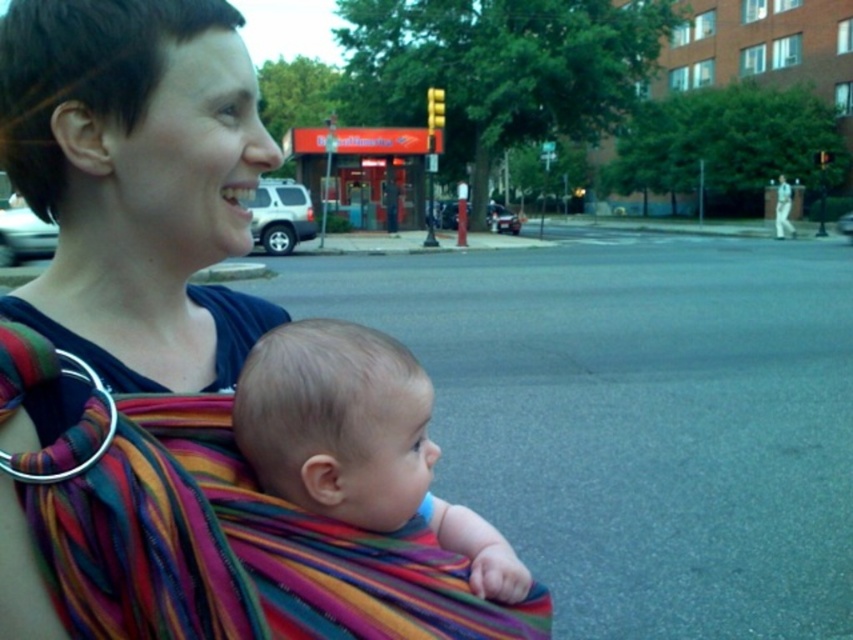
Based on the scene description, where is the multicolored woven carrier at center located in the image?

The multicolored woven carrier at center is located at point [166,358].